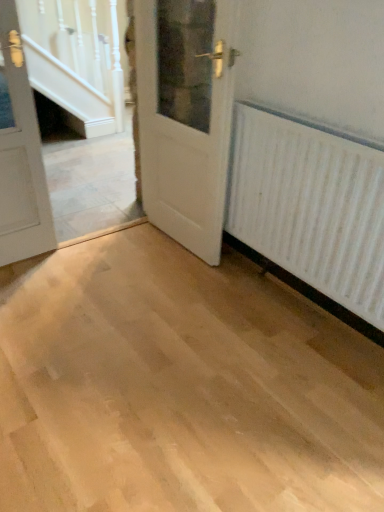
In order to face white wood door at left, the 1th door when ordered from left to right, should I rotate leftwards or rightwards?

Rotate your view left by about 23.804°.

Locate an element on the screen. white textured radiator at right is located at coordinates (310, 204).

Considering the positions of objects white wood door at left, the 2th door viewed from the right, and white textured radiator at right in the image provided, who is behind, white wood door at left, the 2th door viewed from the right, or white textured radiator at right?

white wood door at left, the 2th door viewed from the right, is behind.

Between point (6, 48) and point (322, 169), which one is positioned in front?

Positioned in front is point (322, 169).

Is point (199, 201) closer or farther from the camera than point (46, 193)?

Clearly, point (199, 201) is more distant from the camera than point (46, 193).

Would you say white wood door at left, the 2th door viewed from the right, is part of white wood door at center, placed as the 2th door when sorted from left to right,'s contents?

That's incorrect, white wood door at left, the 2th door viewed from the right, is not inside white wood door at center, placed as the 2th door when sorted from left to right.

Which object is positioned more to the right, white wood door at center, the 1th door positioned from the right, or white wood door at left, the 1th door when ordered from left to right?

white wood door at center, the 1th door positioned from the right, is more to the right.

From their relative heights in the image, would you say white textured radiator at right is taller or shorter than white wood door at left, the 1th door when ordered from left to right?

In the image, white textured radiator at right appears to be shorter than white wood door at left, the 1th door when ordered from left to right.

Between white textured radiator at right and white wood door at left, the 2th door viewed from the right, which one has larger size?

white textured radiator at right is bigger.

From the image's perspective, is white textured radiator at right on white wood door at left, the 1th door when ordered from left to right?

No, from the image's perspective, white textured radiator at right is not over white wood door at left, the 1th door when ordered from left to right.

Which is correct: white textured radiator at right is inside white wood door at left, the 2th door viewed from the right, or outside of it?

white textured radiator at right is outside white wood door at left, the 2th door viewed from the right.

How different are the orientations of white textured radiator at right and white wood door at center, placed as the 2th door when sorted from left to right, in degrees?

The angular difference between white textured radiator at right and white wood door at center, placed as the 2th door when sorted from left to right, is 3.97 degrees.

Is white textured radiator at right facing away from white wood door at center, the 1th door positioned from the right?

No, white wood door at center, the 1th door positioned from the right, is not at the back of white textured radiator at right.

Which object is closer to the camera, white textured radiator at right or white wood door at center, the 1th door positioned from the right?

white textured radiator at right is closer to the camera.

Which of these two, white wood door at center, the 1th door positioned from the right, or white textured radiator at right, stands shorter?

white textured radiator at right.

Who is bigger, white wood door at center, the 1th door positioned from the right, or white textured radiator at right?

With larger size is white wood door at center, the 1th door positioned from the right.

How many degrees apart are the facing directions of white wood door at center, placed as the 2th door when sorted from left to right, and white textured radiator at right?

The angular difference between white wood door at center, placed as the 2th door when sorted from left to right, and white textured radiator at right is 3.97 degrees.

Is white wood door at center, the 1th door positioned from the right, turned away from white textured radiator at right?

That's not correct — white wood door at center, the 1th door positioned from the right, is not looking away from white textured radiator at right.

Considering the relative sizes of white wood door at left, the 2th door viewed from the right, and white wood door at center, the 1th door positioned from the right, in the image provided, is white wood door at left, the 2th door viewed from the right, shorter than white wood door at center, the 1th door positioned from the right,?

Indeed, white wood door at left, the 2th door viewed from the right, has a lesser height compared to white wood door at center, the 1th door positioned from the right.

Is white wood door at left, the 1th door when ordered from left to right, located outside white wood door at center, the 1th door positioned from the right?

Indeed, white wood door at left, the 1th door when ordered from left to right, is completely outside white wood door at center, the 1th door positioned from the right.

Which of these two, white wood door at left, the 1th door when ordered from left to right, or white wood door at center, placed as the 2th door when sorted from left to right, is wider?

With larger width is white wood door at center, placed as the 2th door when sorted from left to right.

Considering the positions of points (9, 234) and (144, 105), is point (9, 234) farther from camera compared to point (144, 105)?

No.

You are a GUI agent. You are given a task and a screenshot of the screen. Output one action in this format:
    pyautogui.click(x=<x>, y=<y>)
    Task: Click on the radiator to the right of white wood door at left, the 1th door when ordered from left to right
    The width and height of the screenshot is (384, 512).
    Given the screenshot: What is the action you would take?
    pyautogui.click(x=310, y=204)

This screenshot has width=384, height=512. I want to click on door located above the white wood door at left, the 1th door when ordered from left to right (from the image's perspective), so click(x=186, y=116).

Considering their positions, is white wood door at center, the 1th door positioned from the right, positioned closer to white textured radiator at right than white wood door at left, the 1th door when ordered from left to right?

white wood door at center, the 1th door positioned from the right.

When comparing their distances from white wood door at left, the 1th door when ordered from left to right, does white textured radiator at right or white wood door at center, the 1th door positioned from the right, seem further?

Among the two, white textured radiator at right is located further to white wood door at left, the 1th door when ordered from left to right.

Which object lies further to the anchor point white wood door at center, the 1th door positioned from the right, white wood door at left, the 2th door viewed from the right, or white textured radiator at right?

white wood door at left, the 2th door viewed from the right.

From the image, which object appears to be nearer to white wood door at center, placed as the 2th door when sorted from left to right, white textured radiator at right or white wood door at left, the 2th door viewed from the right?

Among the two, white textured radiator at right is located nearer to white wood door at center, placed as the 2th door when sorted from left to right.

Estimate the real-world distances between objects in this image. Which object is closer to white textured radiator at right, white wood door at left, the 2th door viewed from the right, or white wood door at center, the 1th door positioned from the right?

Based on the image, white wood door at center, the 1th door positioned from the right, appears to be nearer to white textured radiator at right.

Estimate the real-world distances between objects in this image. Which object is further from white wood door at left, the 2th door viewed from the right, white wood door at center, placed as the 2th door when sorted from left to right, or white textured radiator at right?

Among the two, white textured radiator at right is located further to white wood door at left, the 2th door viewed from the right.

Where is `door between white wood door at left, the 1th door when ordered from left to right, and white textured radiator at right, in the horizontal direction`? The height and width of the screenshot is (512, 384). door between white wood door at left, the 1th door when ordered from left to right, and white textured radiator at right, in the horizontal direction is located at coordinates (186, 116).